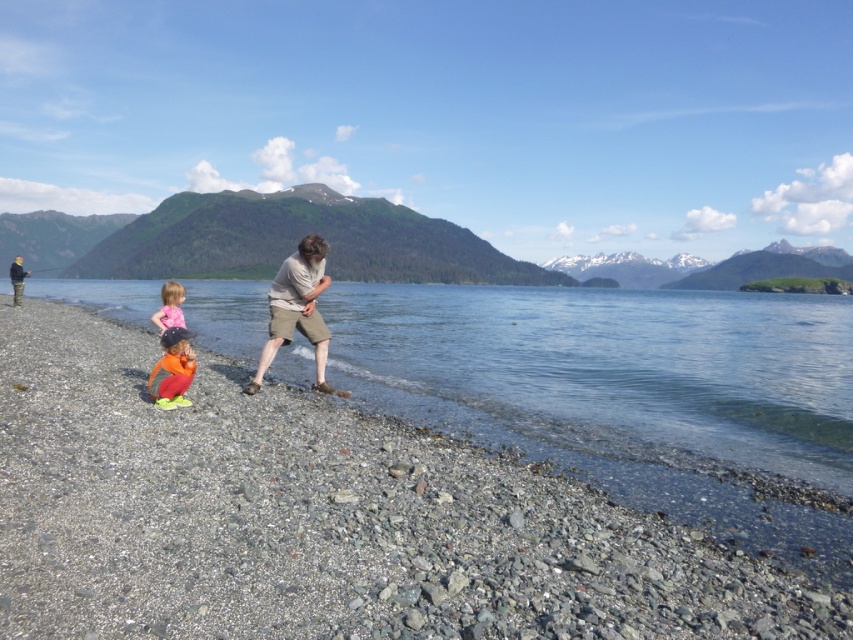
Does smooth gravel beach at center have a smaller size compared to orange fleece pants at lower left?

Incorrect, smooth gravel beach at center is not smaller in size than orange fleece pants at lower left.

Is smooth gravel beach at center below orange fleece pants at lower left?

Yes.

What do you see at coordinates (321, 518) in the screenshot? I see `smooth gravel beach at center` at bounding box center [321, 518].

Image resolution: width=853 pixels, height=640 pixels. Identify the location of smooth gravel beach at center. (321, 518).

Does orange fleece pants at lower left have a larger size compared to pink fabric toddler at lower left?

Incorrect, orange fleece pants at lower left is not larger than pink fabric toddler at lower left.

Consider the image. Who is more forward, (184, 358) or (183, 296)?

Point (184, 358)

This screenshot has width=853, height=640. I want to click on orange fleece pants at lower left, so click(x=172, y=369).

Does smooth gravel beach at center have a lesser width compared to pink fabric toddler at lower left?

No, smooth gravel beach at center is not thinner than pink fabric toddler at lower left.

Between smooth gravel beach at center and pink fabric toddler at lower left, which one is positioned lower?

Positioned lower is smooth gravel beach at center.

At what (x,y) coordinates should I click in order to perform the action: click on smooth gravel beach at center. Please return your answer as a coordinate pair (x, y). This screenshot has height=640, width=853. Looking at the image, I should click on (321, 518).